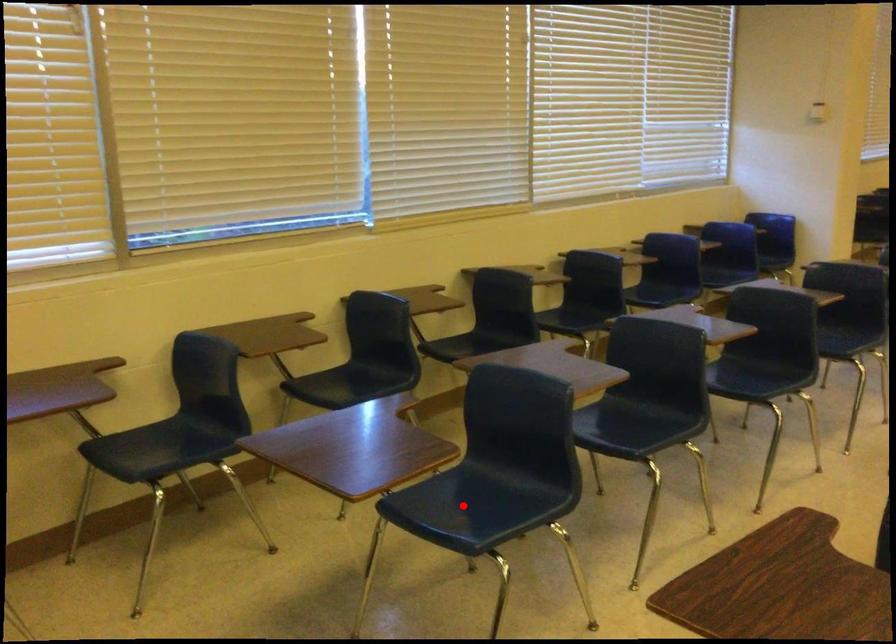
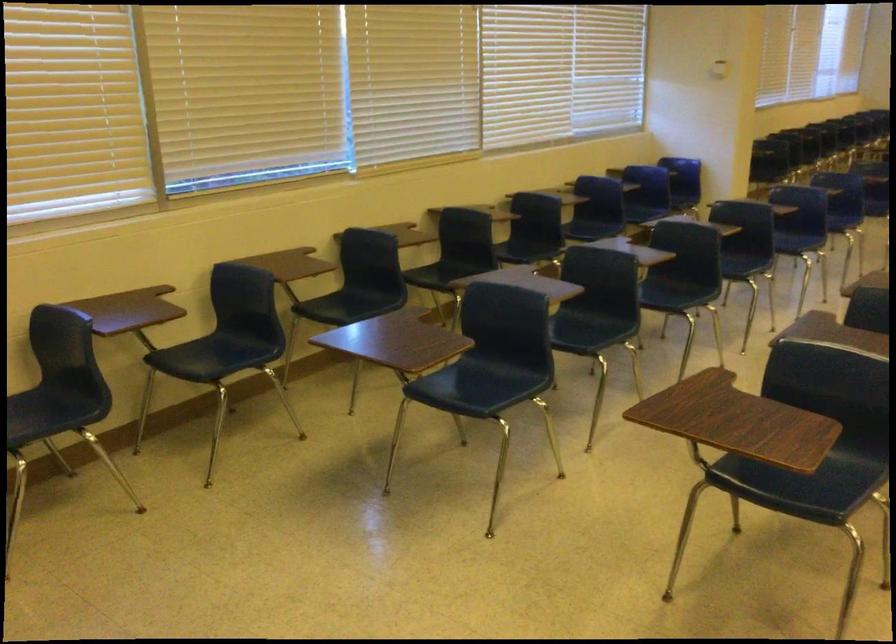
Question: I am providing you with two images of the same scene from different viewpoints. A red point is shown in image1. For the corresponding object point in image2, is it positioned nearer or farther from the camera?

Choices:
 (A) Nearer
 (B) Farther

Answer: (B)